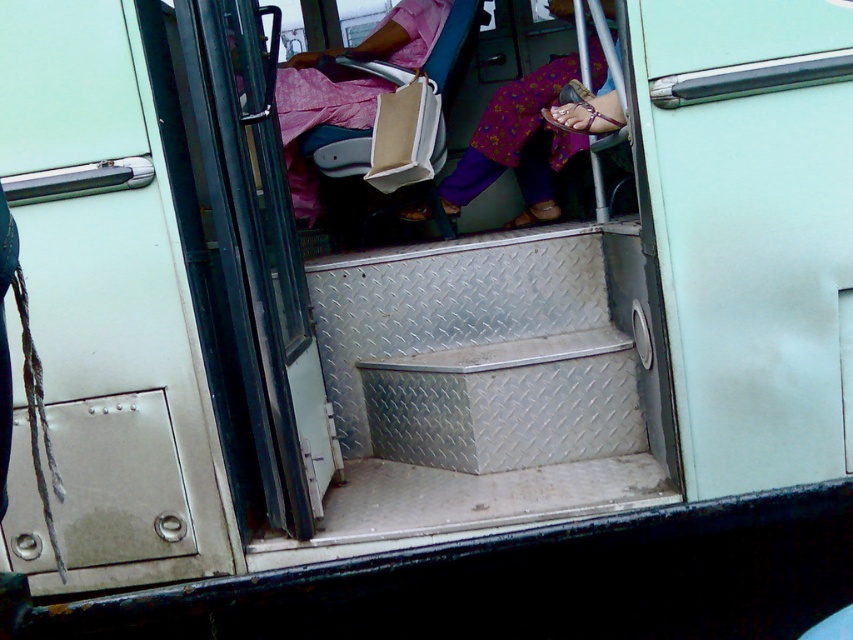
Who is lower down, diamond plate metal stairs at center or floral fabric dress at center?

diamond plate metal stairs at center is lower down.

Does diamond plate metal stairs at center appear under floral fabric dress at center?

Correct, diamond plate metal stairs at center is located below floral fabric dress at center.

Between point (393, 330) and point (525, 122), which one is positioned behind?

The point (525, 122) is behind.

Where is `diamond plate metal stairs at center`? This screenshot has width=853, height=640. diamond plate metal stairs at center is located at coordinates (479, 387).